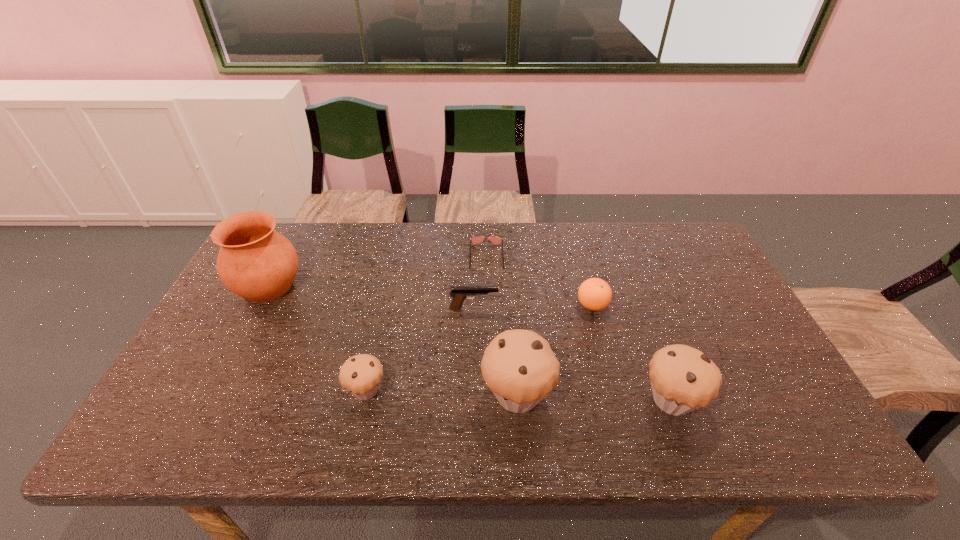
This screenshot has width=960, height=540. Find the location of `object present at the far left corner`. object present at the far left corner is located at coordinates (256, 262).

Identify the location of vacant point at the far edge. (377, 234).

I want to click on vacant space at the near edge of the desktop, so click(605, 410).

The height and width of the screenshot is (540, 960). I want to click on blank space at the left edge of the desktop, so click(203, 360).

The width and height of the screenshot is (960, 540). Identify the location of vacant space at the right edge of the desktop. (734, 341).

The height and width of the screenshot is (540, 960). I want to click on vacant area at the far right corner of the desktop, so click(691, 229).

Find the location of `vacant region between the leftmost muffin and the shortest object`. vacant region between the leftmost muffin and the shortest object is located at coordinates [x=426, y=323].

Locate an element on the screen. This screenshot has width=960, height=540. vacant space that is in between the sixth object from right to left and the second muffin from left to right is located at coordinates (442, 392).

This screenshot has height=540, width=960. Find the location of `vacant point located between the rightmost object and the sixth object from left to right`. vacant point located between the rightmost object and the sixth object from left to right is located at coordinates (632, 353).

This screenshot has height=540, width=960. What are the coordinates of `empty space that is in between the shortest object and the leftmost muffin` in the screenshot? It's located at (426, 323).